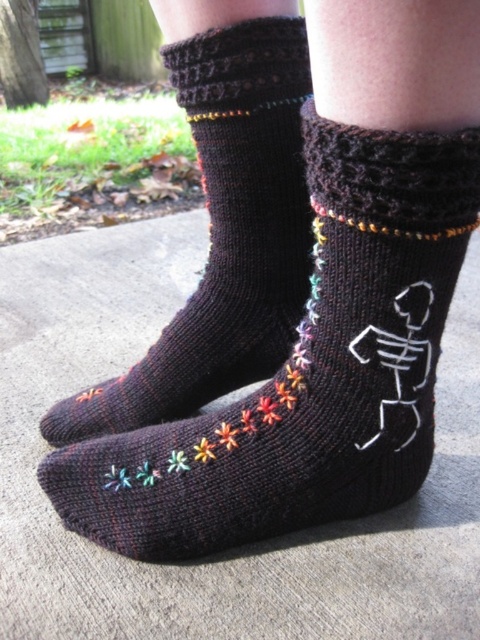
You are a tailor measuring the distance between the two black knitted socks at center. The minimum distance required for your sewing machine to handle two socks at once is 20 inches. Can you process both socks simultaneously?

The two black knitted socks at center are 20.05 inches apart, which is slightly more than the 20 inches required. Therefore, the sewing machine can process both socks simultaneously.

You are trying to determine which pair of socks is closer to you. You see two pairs of black knitted socks at center and black knitted socks at lower left. Which one is closer to you?

The black knitted socks at center is closer to you because it is in front of the black knitted socks at lower left.

You are a photographer setting up a shoot and need to adjust the lighting to highlight both the black knitted socks at center and the black knitted socks at lower left. Since the socks are stacked, which one should you focus on first to ensure proper lighting?

The black knitted socks at lower left should be focused on first because the black knitted socks at center is positioned under it, so adjusting the lower left socks first will prevent shadows from affecting the lower socks.